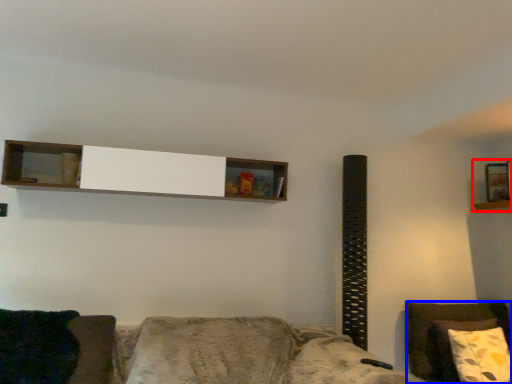
Question: Which point is closer to the camera, shelf (highlighted by a red box) or furniture (highlighted by a blue box)?

Choices:
 (A) shelf
 (B) furniture

Answer: (B)